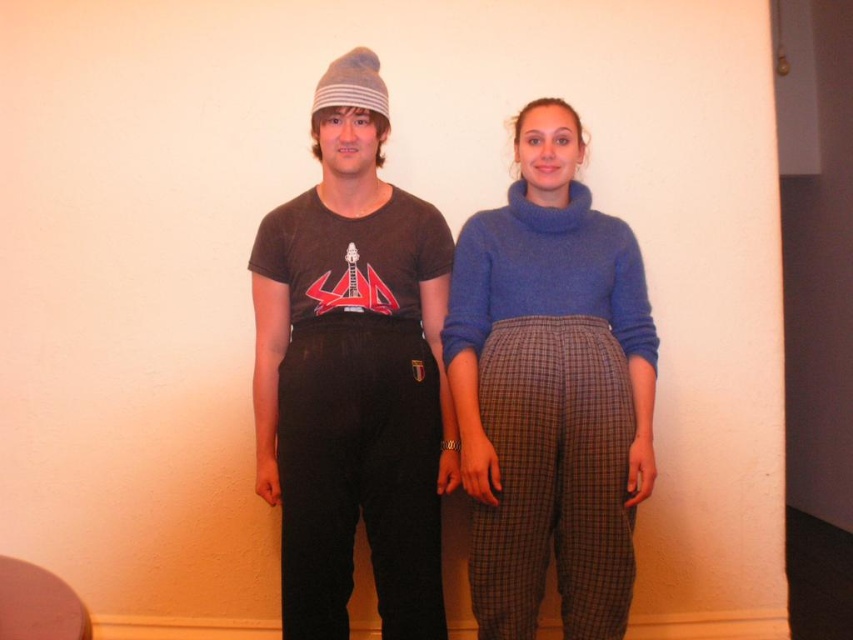
Question: Is matte black pants at center to the right of blue woolen sweater at center from the viewer's perspective?

Choices:
 (A) yes
 (B) no

Answer: (B)

Question: Among these points, which one is farthest from the camera?

Choices:
 (A) 616,221
 (B) 352,100
 (C) 583,353

Answer: (A)

Question: From the image, what is the correct spatial relationship of matte black pants at center in relation to plaid wool pants at center?

Choices:
 (A) right
 (B) left

Answer: (B)

Question: Among these objects, which one is farthest from the camera?

Choices:
 (A) blue woolen sweater at center
 (B) matte black pants at center
 (C) striped knit beanie at center

Answer: (B)

Question: Which point is farther to the camera?

Choices:
 (A) matte black pants at center
 (B) plaid wool pants at center

Answer: (B)

Question: Where is blue woolen sweater at center located in relation to striped knit beanie at center in the image?

Choices:
 (A) right
 (B) left

Answer: (A)